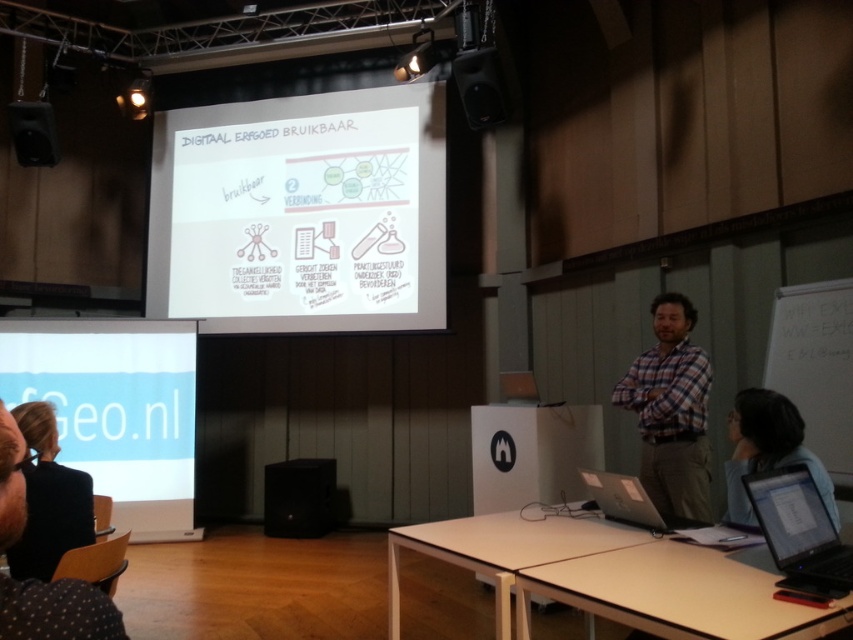
Question: Can you confirm if plaid fabric shirt at center is bigger than black glossy laptop at lower right?

Choices:
 (A) yes
 (B) no

Answer: (A)

Question: Which point is closer to the camera taking this photo?

Choices:
 (A) (28, 125)
 (B) (334, 218)
 (C) (776, 422)

Answer: (C)

Question: Does white paper at center have a greater width compared to black matte speaker at lower center?

Choices:
 (A) yes
 (B) no

Answer: (A)

Question: Which point is closer to the camera taking this photo?

Choices:
 (A) (33, 529)
 (B) (126, 468)
 (C) (514, 397)

Answer: (A)

Question: Which of the following is the closest to the observer?

Choices:
 (A) white paper at center
 (B) blue fabric shirt at lower right
 (C) silver metallic laptop at center

Answer: (B)

Question: Can you confirm if black glossy laptop at lower right is smaller than silver metallic laptop at center?

Choices:
 (A) yes
 (B) no

Answer: (A)